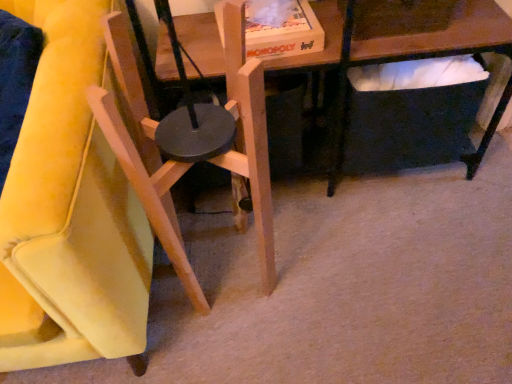
This screenshot has width=512, height=384. What do you see at coordinates (143, 152) in the screenshot?
I see `natural wood chair at center, positioned as the first chair in right-to-left order` at bounding box center [143, 152].

You are a GUI agent. You are given a task and a screenshot of the screen. Output one action in this format:
    pyautogui.click(x=<x>, y=<y>)
    Task: Click on the natural wood chair at center, which is the second chair from left to right
    The width and height of the screenshot is (512, 384).
    Given the screenshot: What is the action you would take?
    pyautogui.click(x=143, y=152)

Locate an element on the screen. wooden chair at left, which is counted as the second chair, starting from the right is located at coordinates [x=70, y=211].

Describe the element at coordinates (70, 211) in the screenshot. I see `wooden chair at left, which is counted as the second chair, starting from the right` at that location.

Find the location of a particular element. This screenshot has width=512, height=384. natural wood chair at center, positioned as the first chair in right-to-left order is located at coordinates point(143,152).

Between wooden chair at left, arranged as the first chair when viewed from the left, and natural wood chair at center, positioned as the first chair in right-to-left order, which one appears on the right side from the viewer's perspective?

natural wood chair at center, positioned as the first chair in right-to-left order, is more to the right.

Between wooden chair at left, arranged as the first chair when viewed from the left, and natural wood chair at center, positioned as the first chair in right-to-left order, which one is positioned behind?

natural wood chair at center, positioned as the first chair in right-to-left order, is behind.

Which is in front, point (32, 0) or point (261, 265)?

Positioned in front is point (32, 0).

From the image's perspective, is wooden chair at left, arranged as the first chair when viewed from the left, on natural wood chair at center, which is the second chair from left to right?

Yes.

Consider the image. From a real-world perspective, is wooden chair at left, arranged as the first chair when viewed from the left, above or below natural wood chair at center, which is the second chair from left to right?

wooden chair at left, arranged as the first chair when viewed from the left, is situated lower than natural wood chair at center, which is the second chair from left to right, in the real world.

From the picture: Between wooden chair at left, arranged as the first chair when viewed from the left, and natural wood chair at center, positioned as the first chair in right-to-left order, which one has larger width?

wooden chair at left, arranged as the first chair when viewed from the left.

Does wooden chair at left, arranged as the first chair when viewed from the left, have a lesser height compared to natural wood chair at center, which is the second chair from left to right?

No, wooden chair at left, arranged as the first chair when viewed from the left, is not shorter than natural wood chair at center, which is the second chair from left to right.

Looking at the image, does wooden chair at left, arranged as the first chair when viewed from the left, seem bigger or smaller compared to natural wood chair at center, positioned as the first chair in right-to-left order?

wooden chair at left, arranged as the first chair when viewed from the left, is bigger than natural wood chair at center, positioned as the first chair in right-to-left order.

Is wooden chair at left, arranged as the first chair when viewed from the left, spatially inside natural wood chair at center, which is the second chair from left to right, or outside of it?

The correct answer is: outside.

Is wooden chair at left, which is counted as the second chair, starting from the right, beside natural wood chair at center, which is the second chair from left to right?

No, wooden chair at left, which is counted as the second chair, starting from the right, is not making contact with natural wood chair at center, which is the second chair from left to right.

Is wooden chair at left, arranged as the first chair when viewed from the left, positioned with its back to natural wood chair at center, positioned as the first chair in right-to-left order?

No.

What's the angular difference between wooden chair at left, which is counted as the second chair, starting from the right, and natural wood chair at center, which is the second chair from left to right,'s facing directions?

The angular difference between wooden chair at left, which is counted as the second chair, starting from the right, and natural wood chair at center, which is the second chair from left to right, is 9.26 degrees.

Measure the distance from wooden chair at left, arranged as the first chair when viewed from the left, to natural wood chair at center, which is the second chair from left to right.

6.82 inches.

At what (x,y) coordinates should I click in order to perform the action: click on chair on the left of the natural wood chair at center, positioned as the first chair in right-to-left order. Please return your answer as a coordinate pair (x, y). This screenshot has height=384, width=512. Looking at the image, I should click on (70, 211).

Which is more to the left, natural wood chair at center, positioned as the first chair in right-to-left order, or wooden chair at left, arranged as the first chair when viewed from the left?

From the viewer's perspective, wooden chair at left, arranged as the first chair when viewed from the left, appears more on the left side.

Is natural wood chair at center, which is the second chair from left to right, further to the viewer compared to wooden chair at left, arranged as the first chair when viewed from the left?

Yes, natural wood chair at center, which is the second chair from left to right, is behind wooden chair at left, arranged as the first chair when viewed from the left.

Does point (260, 243) come in front of point (13, 366)?

No.

From the image's perspective, which object appears higher, natural wood chair at center, which is the second chair from left to right, or wooden chair at left, which is counted as the second chair, starting from the right?

wooden chair at left, which is counted as the second chair, starting from the right, is shown above in the image.

From a real-world perspective, who is located lower, natural wood chair at center, which is the second chair from left to right, or wooden chair at left, which is counted as the second chair, starting from the right?

wooden chair at left, which is counted as the second chair, starting from the right.

Which of these two, natural wood chair at center, positioned as the first chair in right-to-left order, or wooden chair at left, which is counted as the second chair, starting from the right, is wider?

Wider between the two is wooden chair at left, which is counted as the second chair, starting from the right.

Considering the sizes of objects natural wood chair at center, positioned as the first chair in right-to-left order, and wooden chair at left, arranged as the first chair when viewed from the left, in the image provided, who is shorter, natural wood chair at center, positioned as the first chair in right-to-left order, or wooden chair at left, arranged as the first chair when viewed from the left,?

With less height is natural wood chair at center, positioned as the first chair in right-to-left order.

Between natural wood chair at center, which is the second chair from left to right, and wooden chair at left, which is counted as the second chair, starting from the right, which one has smaller size?

Smaller between the two is natural wood chair at center, which is the second chair from left to right.

Would you say natural wood chair at center, positioned as the first chair in right-to-left order, is inside or outside wooden chair at left, which is counted as the second chair, starting from the right?

natural wood chair at center, positioned as the first chair in right-to-left order, is not inside wooden chair at left, which is counted as the second chair, starting from the right, it's outside.

In the scene shown: Is natural wood chair at center, positioned as the first chair in right-to-left order, next to wooden chair at left, arranged as the first chair when viewed from the left?

natural wood chair at center, positioned as the first chair in right-to-left order, and wooden chair at left, arranged as the first chair when viewed from the left, are clearly separated.

Is natural wood chair at center, which is the second chair from left to right, aimed at wooden chair at left, arranged as the first chair when viewed from the left?

No, natural wood chair at center, which is the second chair from left to right, does not turn towards wooden chair at left, arranged as the first chair when viewed from the left.

Looking at this image, how different are the orientations of natural wood chair at center, which is the second chair from left to right, and wooden chair at left, which is counted as the second chair, starting from the right, in degrees?

The angular difference between natural wood chair at center, which is the second chair from left to right, and wooden chair at left, which is counted as the second chair, starting from the right, is 9.26 degrees.

Identify the location of chair behind the wooden chair at left, which is counted as the second chair, starting from the right. Image resolution: width=512 pixels, height=384 pixels. (143, 152).

At what (x,y) coordinates should I click in order to perform the action: click on chair that is in front of the natural wood chair at center, positioned as the first chair in right-to-left order. Please return your answer as a coordinate pair (x, y). Image resolution: width=512 pixels, height=384 pixels. Looking at the image, I should click on (70, 211).

This screenshot has width=512, height=384. I want to click on chair behind the wooden chair at left, arranged as the first chair when viewed from the left, so pyautogui.click(x=143, y=152).